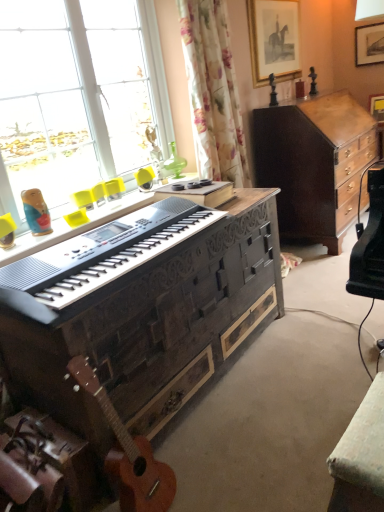
Question: Choose the correct answer: Is woodendesk at center inside orange wood guitar at lower left or outside it?

Choices:
 (A) outside
 (B) inside

Answer: (A)

Question: In terms of height, does woodendesk at center look taller or shorter compared to orange wood guitar at lower left?

Choices:
 (A) tall
 (B) short

Answer: (A)

Question: Estimate the real-world distances between objects in this image. Which object is closer to the black textured piano at center?

Choices:
 (A) transparent glass window at upper left
 (B) orange wood guitar at lower left
 (C) dark wood cabinet at center right
 (D) wooden picture frame at upper right, which appears as the first picture frame when viewed from the right
 (E) wooden framed picture at upper right, the 2th picture frame in the right-to-left sequence

Answer: (B)

Question: Estimate the real-world distances between objects in this image. Which object is farther from the transparent glass window at upper left?

Choices:
 (A) orange wood guitar at lower left
 (B) wooden framed picture at upper right, marked as the 1th picture frame in a left-to-right arrangement
 (C) black textured piano at center
 (D) dark wood cabinet at center right
 (E) wooden picture frame at upper right, the 2th picture frame viewed from the front

Answer: (E)